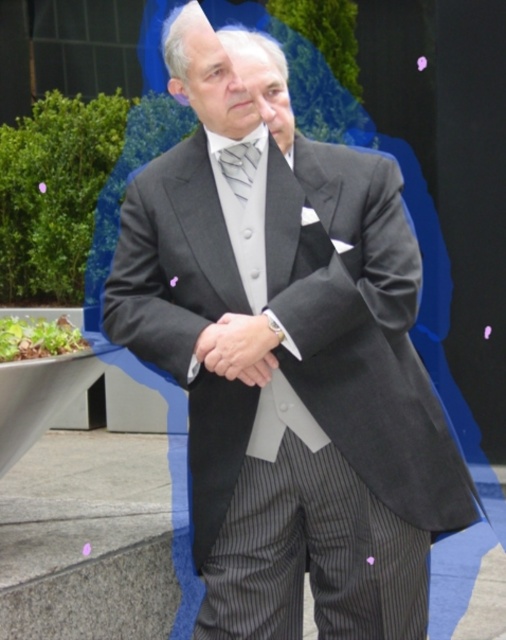
You are an artist trying to sketch the scene. You need to place the smooth gray suit at center in your drawing. According to the coordinates provided, where should you position it on a standard 8.5x11 inch paper?

The smooth gray suit at center should be positioned at approximately 4.66 inches from the left edge and 5.24 inches from the bottom edge of the paper, based on the coordinates given.

You are a fashion designer analyzing the outfit of a man in an outdoor setting. You need to determine if the smooth gray suit at center can be seen from above the silvery metallic tie at center. Based on their positions, can you confirm this?

The smooth gray suit at center is taller than the silvery metallic tie at center, so yes, the smooth gray suit at center can be seen from above the silvery metallic tie at center because it extends higher.